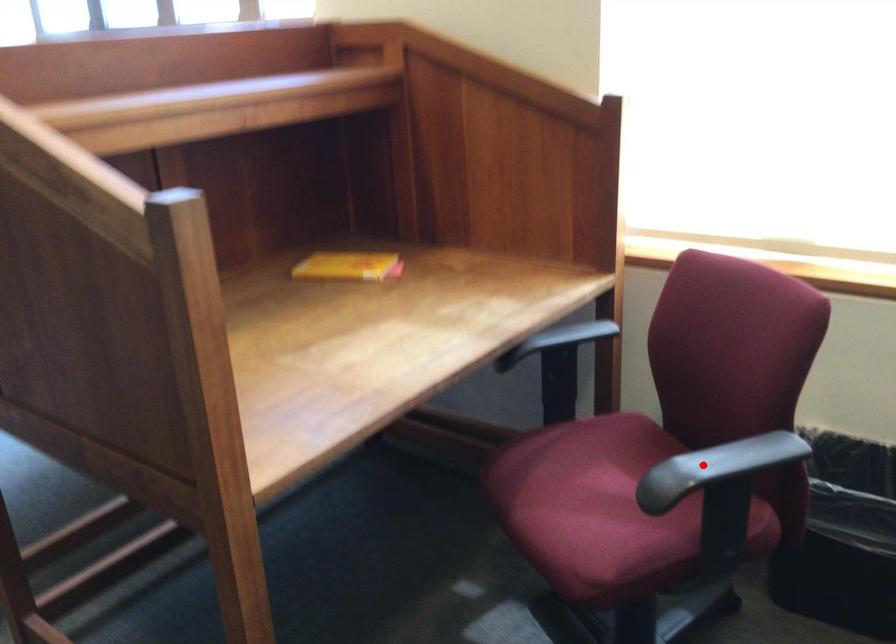
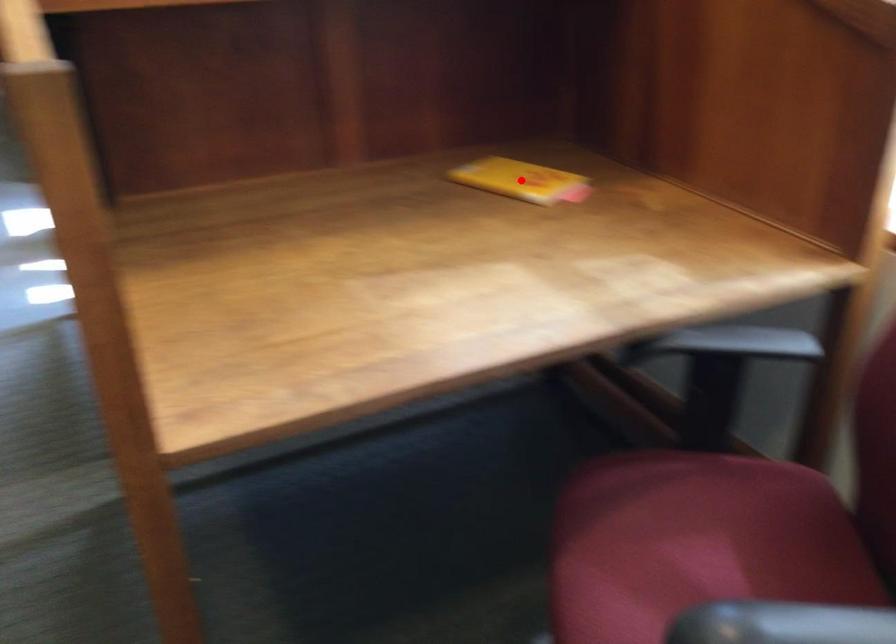
I am providing you with two images of the same scene from different viewpoints. A red point is marked on the first image and another point is marked on the second image. Do the highlighted points in image1 and image2 indicate the same real-world spot?

No